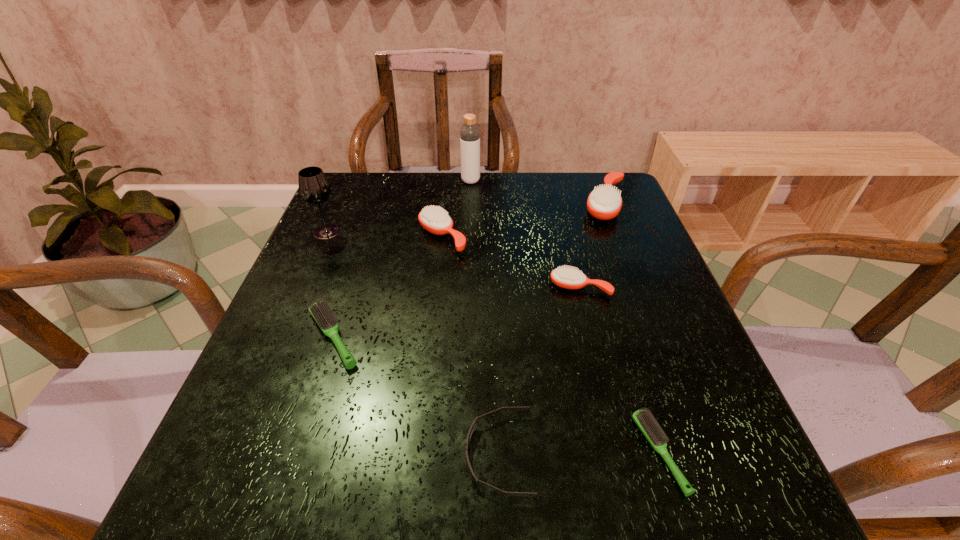
Locate an element on the screen. The image size is (960, 540). vacant space positioned 0.200m on the left of the shortest hairbrush is located at coordinates (510, 453).

Where is `free point located on the front-facing side of the sunglasses`? Image resolution: width=960 pixels, height=540 pixels. free point located on the front-facing side of the sunglasses is located at coordinates (354, 454).

At what (x,y) coordinates should I click in order to perform the action: click on vacant region located on the front-facing side of the sunglasses. Please return your answer as a coordinate pair (x, y). This screenshot has height=540, width=960. Looking at the image, I should click on (394, 454).

Where is `vacant space positioned 0.370m on the front-facing side of the sunglasses`? The height and width of the screenshot is (540, 960). vacant space positioned 0.370m on the front-facing side of the sunglasses is located at coordinates (223, 454).

Find the location of a particular element. Image resolution: width=960 pixels, height=540 pixels. bottle located in the far edge section of the desktop is located at coordinates (469, 133).

Where is `hairbrush that is at the far edge`? This screenshot has height=540, width=960. hairbrush that is at the far edge is located at coordinates (605, 202).

The image size is (960, 540). I want to click on hairbrush situated at the near edge, so click(644, 420).

Locate an element on the screen. sunglasses that is at the near edge is located at coordinates (470, 432).

The image size is (960, 540). Identify the location of wineglass present at the left edge. (314, 188).

Where is `hairbrush at the left edge`? hairbrush at the left edge is located at coordinates (321, 312).